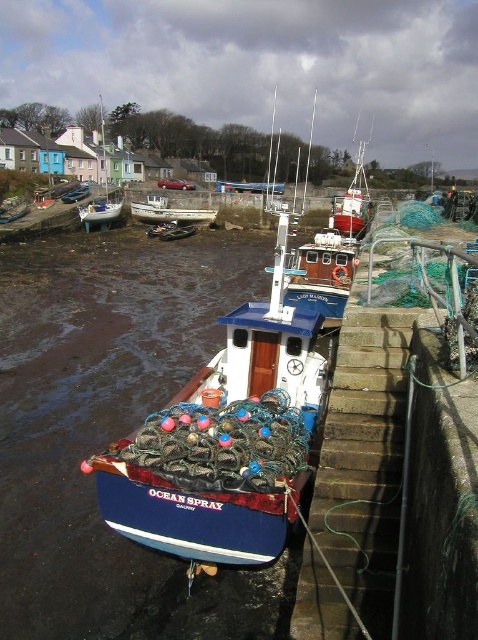
You are a harbor worker who needs to load a large crate onto the blue matte fishing boat at center and the white wooden boat at center. Based on their sizes, which boat can accommodate the crate more easily?

The white wooden boat at center is larger than the blue matte fishing boat at center, so it can accommodate the crate more easily.

You are a harbor worker who needs to move a 10 meter long cargo container from the white wooden boat at center to the blue painted wooden boat at lower left. Can you transport the cargo container between them without it getting stuck?

The distance between the white wooden boat at center and the blue painted wooden boat at lower left is 13.15 meters. Since the cargo container is only 10 meters long, it can be transported between them without getting stuck as the gap is wider than the container.

You are a photographer standing at the edge of the harbor. You want to capture a photo that includes both the blue matte fishing boat at center and the white wooden boat at center. Which boat should you position to the left side of your frame to include both in the shot?

You should position the white wooden boat at center to the left side of your frame because the blue matte fishing boat at center is to the right of it.